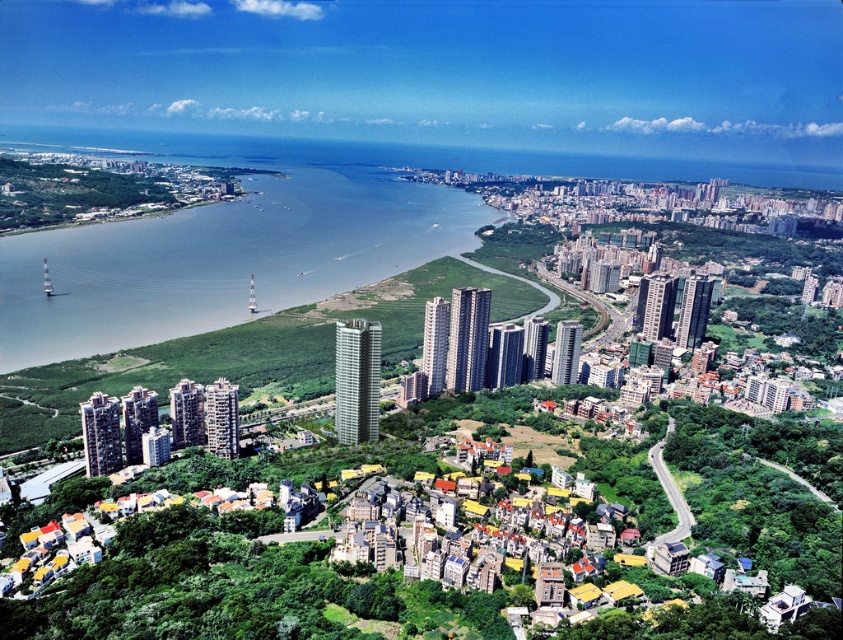
Is the position of gray water at center more distant than that of green grassy hillside at lower left?

Yes, gray water at center is behind green grassy hillside at lower left.

Who is positioned more to the left, gray water at center or green grassy hillside at lower left?

Positioned to the left is gray water at center.

Who is more forward, (358, 243) or (68, 422)?

Point (68, 422) is more forward.

Locate an element on the screen. The height and width of the screenshot is (640, 843). gray water at center is located at coordinates (223, 259).